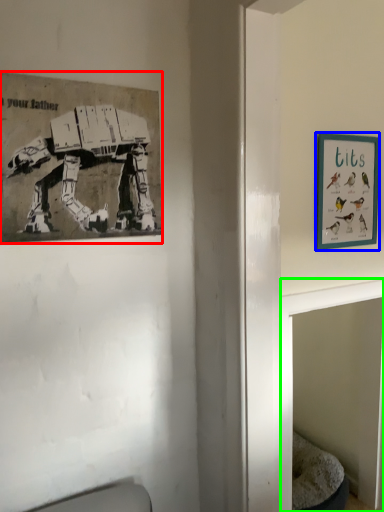
Question: Considering the real-world distances, which object is closest to picture frame (highlighted by a red box)? picture frame (highlighted by a blue box) or table (highlighted by a green box).

Choices:
 (A) picture frame
 (B) table

Answer: (B)